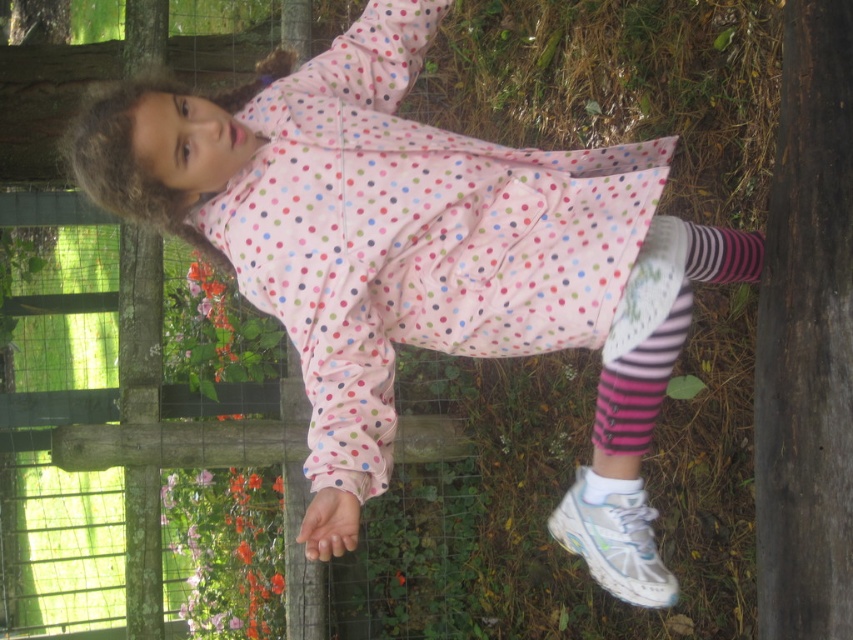
Question: Which object appears closest to the camera in this image?

Choices:
 (A) white smooth sock at lower center
 (B) white mesh shoe at lower right

Answer: (B)

Question: Does white mesh shoe at lower right have a smaller size compared to white smooth sock at lower center?

Choices:
 (A) yes
 (B) no

Answer: (B)

Question: Does white mesh shoe at lower right appear on the left side of white smooth sock at lower center?

Choices:
 (A) no
 (B) yes

Answer: (A)

Question: Which point is closer to the camera taking this photo?

Choices:
 (A) (641, 488)
 (B) (619, 477)

Answer: (B)

Question: Does white mesh shoe at lower right have a smaller size compared to white smooth sock at lower center?

Choices:
 (A) yes
 (B) no

Answer: (B)